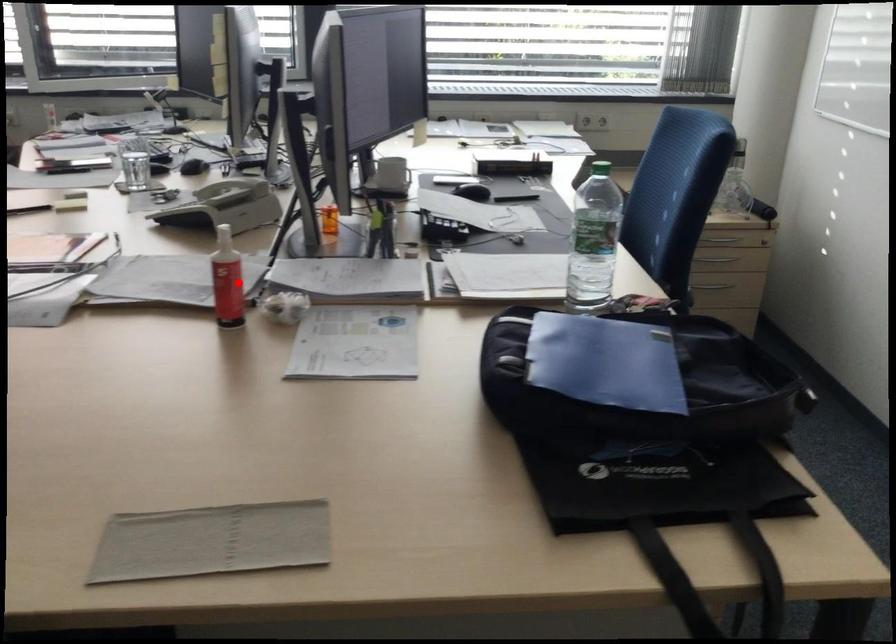
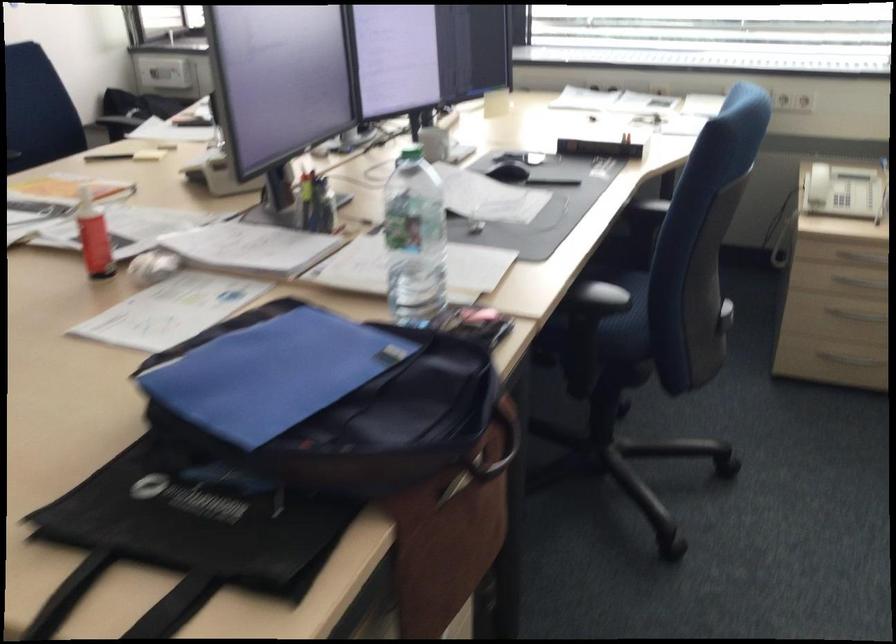
In the second image, find the point that corresponds to the highlighted location in the first image.

(92, 236)